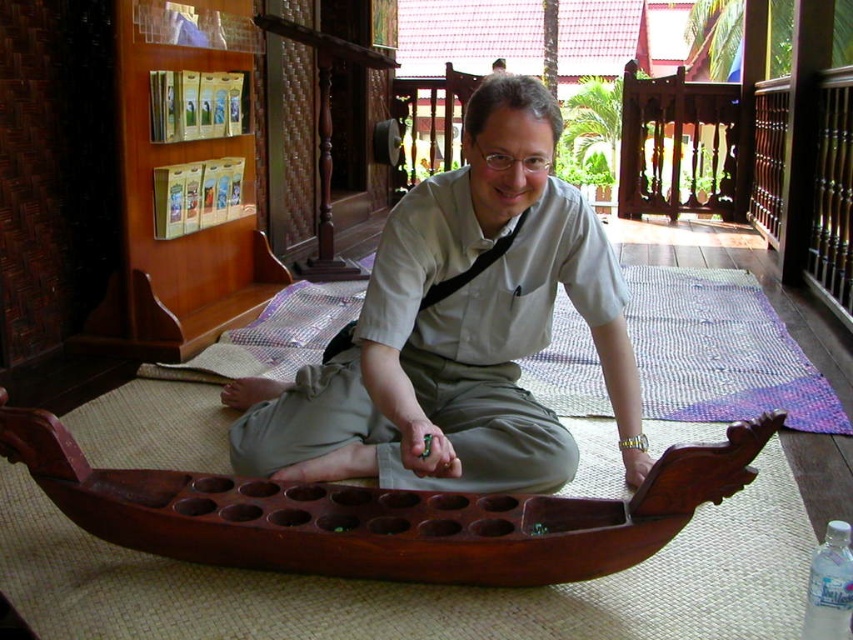
You are organizing a small event in the room and need to place a new decorative item. If you want to place it in front of the clear plastic bottle at lower right, where should you place it in relation to the matte beige shirt at center?

The clear plastic bottle at lower right is behind the matte beige shirt at center, so placing the decorative item in front of the clear plastic bottle at lower right would mean placing it behind the matte beige shirt at center.

In the scene shown: You are trying to place the clear plastic bottle at lower right inside the dark wood rowboat at center. Based on their sizes, will the bottle fit inside the rowboat?

The dark wood rowboat at center might be wider than clear plastic bottle at lower right, so there is a possibility that the bottle could fit inside the rowboat depending on its dimensions.

Based on the scene described, where is the matte beige shirt at center in relation to the clear plastic bottle at lower right?

The matte beige shirt at center is above the clear plastic bottle at lower right.